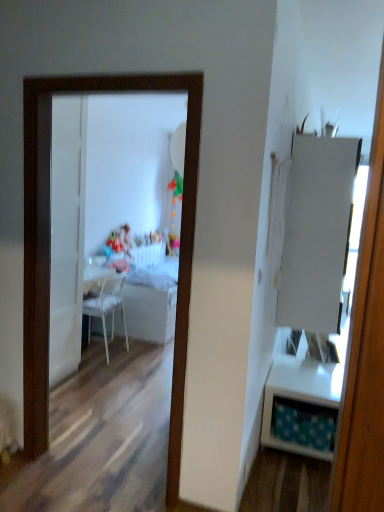
What do you see at coordinates (67, 234) in the screenshot?
I see `white glossy door at center` at bounding box center [67, 234].

What is the approximate height of white glossy table at center, the first table viewed from the left?

The height of white glossy table at center, the first table viewed from the left, is 31.13 inches.

How much space does white glossy table at right, placed as the 1th table when sorted from front to back, occupy horizontally?

white glossy table at right, placed as the 1th table when sorted from front to back, is 21.99 inches in width.

You are a GUI agent. You are given a task and a screenshot of the screen. Output one action in this format:
    pyautogui.click(x=<x>, y=<y>)
    Task: Click on the white glossy mirror at center
    
    Given the screenshot: What is the action you would take?
    pyautogui.click(x=49, y=246)

The width and height of the screenshot is (384, 512). What do you see at coordinates (107, 307) in the screenshot? I see `white plastic chair at center` at bounding box center [107, 307].

Where is `white matte cabinet at right`? white matte cabinet at right is located at coordinates (317, 232).

Where is `white glossy door at center`? This screenshot has height=512, width=384. white glossy door at center is located at coordinates (67, 234).

Does white glossy table at center, the second table from the front, have a greater width compared to white glossy mirror at center?

Correct, the width of white glossy table at center, the second table from the front, exceeds that of white glossy mirror at center.

Which is closer, (116, 308) or (29, 345)?

Point (116, 308) is farther from the camera than point (29, 345).

Can you confirm if white glossy table at center, the second table from the front, is shorter than white glossy mirror at center?

Indeed, white glossy table at center, the second table from the front, has a lesser height compared to white glossy mirror at center.

There is a white glossy mirror at center. Where is `the 1st table below it (from a real-world perspective)`? This screenshot has height=512, width=384. the 1st table below it (from a real-world perspective) is located at coordinates (152, 301).

From their relative heights in the image, would you say matte plastic toy at center is taller or shorter than white plastic chair at center?

matte plastic toy at center is shorter than white plastic chair at center.

I want to click on toy that appears above the white plastic chair at center (from a real-world perspective), so click(x=118, y=241).

Is matte plastic toy at center situated inside white plastic chair at center or outside?

matte plastic toy at center is located beyond the bounds of white plastic chair at center.

Considering the sizes of matte plastic toy at center and white plastic chair at center in the image, is matte plastic toy at center wider or thinner than white plastic chair at center?

matte plastic toy at center is thinner than white plastic chair at center.

From a real-world perspective, is white glossy door at center located higher than white matte cabinet at right?

No, from a real-world perspective, white glossy door at center is not above white matte cabinet at right.

Is white glossy door at center wider than white matte cabinet at right?

No.

Looking at this image, can you confirm if white glossy door at center is smaller than white matte cabinet at right?

Indeed, white glossy door at center has a smaller size compared to white matte cabinet at right.

Does white matte cabinet at right contain white plastic chair at center?

No.

Looking at this image, considering the sizes of objects white matte cabinet at right and white plastic chair at center in the image provided, who is taller, white matte cabinet at right or white plastic chair at center?

white matte cabinet at right.

Where is `chair below the white matte cabinet at right (from the image's perspective)`? This screenshot has width=384, height=512. chair below the white matte cabinet at right (from the image's perspective) is located at coordinates (107, 307).

From the image's perspective, does white plastic chair at center appear lower than white glossy table at right, placed as the 1th table when sorted from front to back?

Actually, white plastic chair at center appears above white glossy table at right, placed as the 1th table when sorted from front to back, in the image.

Does white plastic chair at center have a lesser width compared to white glossy table at right, the 1th table from the right?

Yes.

Who is smaller, white plastic chair at center or white glossy table at right, the 1th table from the right?

Smaller between the two is white plastic chair at center.

Is white plastic chair at center with white glossy table at right, marked as the second table in a back-to-front arrangement?

white plastic chair at center and white glossy table at right, marked as the second table in a back-to-front arrangement, are not in contact.

From the image's perspective, is white plastic chair at center over white matte cabinet at right?

Actually, white plastic chair at center appears below white matte cabinet at right in the image.

Does point (104, 315) come closer to viewer compared to point (307, 265)?

No, it is behind (307, 265).

Which of these two, white plastic chair at center or white matte cabinet at right, is bigger?

Bigger between the two is white matte cabinet at right.

Who is more distant, white glossy table at center, the 1th table positioned from the back, or white plastic chair at center?

white glossy table at center, the 1th table positioned from the back, is further away from the camera.

From the image's perspective, which one is positioned higher, white glossy table at center, the 1th table positioned from the back, or white plastic chair at center?

white glossy table at center, the 1th table positioned from the back.

Considering the points (150, 280) and (127, 351), which point is behind, point (150, 280) or point (127, 351)?

Point (150, 280)

Are white glossy table at center, the second table from the front, and white plastic chair at center beside each other?

No, white glossy table at center, the second table from the front, is not beside white plastic chair at center.

There is a white glossy table at center, the 2th table viewed from the right. Where is `mirror above it (from a real-world perspective)`? mirror above it (from a real-world perspective) is located at coordinates (49, 246).

You are a GUI agent. You are given a task and a screenshot of the screen. Output one action in this format:
    pyautogui.click(x=<x>, y=<y>)
    Task: Click on the chair on the right side of matte plastic toy at center
    
    Given the screenshot: What is the action you would take?
    (107, 307)

Based on their spatial positions, is white plastic chair at center or white glossy mirror at center further from white glossy door at center?

The object further to white glossy door at center is white glossy mirror at center.

Estimate the real-world distances between objects in this image. Which object is closer to white glossy table at center, the 1th table positioned from the back, white matte cabinet at right or white glossy mirror at center?

white matte cabinet at right.

Considering their positions, is white glossy door at center positioned further to white glossy mirror at center than white plastic chair at center?

white plastic chair at center.

Considering their positions, is white glossy mirror at center positioned closer to matte plastic toy at center than white glossy door at center?

Based on the image, white glossy door at center appears to be nearer to matte plastic toy at center.

Consider the image. When comparing their distances from white glossy mirror at center, does white glossy door at center or white glossy table at center, the second table from the front, seem closer?

white glossy door at center is closer to white glossy mirror at center.

Which object lies further to the anchor point white glossy mirror at center, white matte cabinet at right or white glossy door at center?

white matte cabinet at right lies further to white glossy mirror at center than the other object.

Based on the photo, which object lies further to the anchor point white glossy table at right, placed as the 1th table when sorted from front to back, white matte cabinet at right or white plastic chair at center?

Based on the image, white plastic chair at center appears to be further to white glossy table at right, placed as the 1th table when sorted from front to back.

Considering their positions, is white glossy door at center positioned further to matte plastic toy at center than white glossy table at center, the 1th table positioned from the back?

Based on the image, white glossy door at center appears to be further to matte plastic toy at center.

At what (x,y) coordinates should I click in order to perform the action: click on table between white plastic chair at center and matte plastic toy at center along the z-axis. Please return your answer as a coordinate pair (x, y). Looking at the image, I should click on (152, 301).

You are a GUI agent. You are given a task and a screenshot of the screen. Output one action in this format:
    pyautogui.click(x=<x>, y=<y>)
    Task: Click on the armoire located between white plastic chair at center and white glossy table at right, the 1th table from the right, in the left-right direction
    
    Given the screenshot: What is the action you would take?
    pyautogui.click(x=317, y=232)

Identify the location of armoire between white glossy mirror at center and matte plastic toy at center in the front-back direction. This screenshot has height=512, width=384. (317, 232).

Locate an element on the screen. This screenshot has height=512, width=384. mirror located between white plastic chair at center and white matte cabinet at right in the left-right direction is located at coordinates (49, 246).